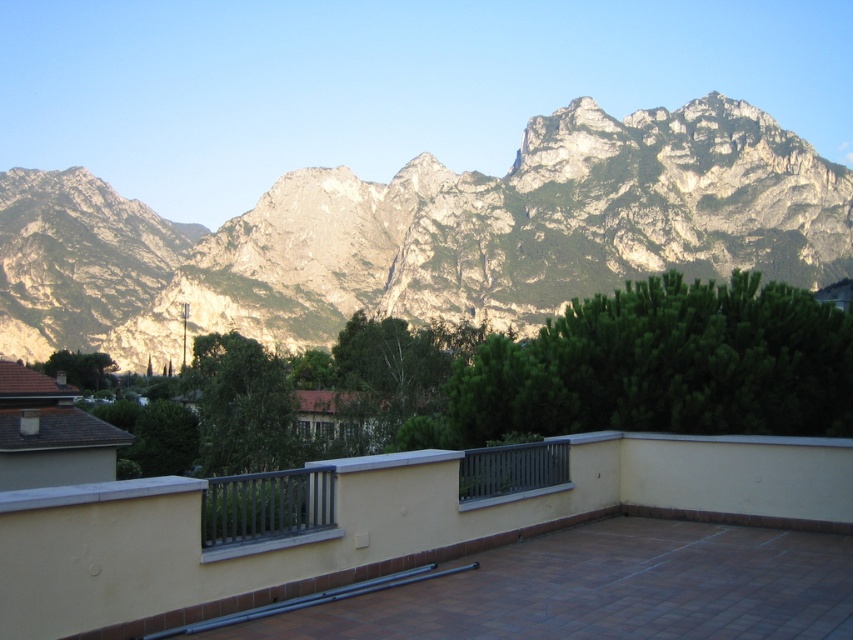
Is point (827, 208) positioned after point (219, 620)?

Yes, point (827, 208) is behind point (219, 620).

Where is `rocky gray mountain range at upper center`? The height and width of the screenshot is (640, 853). rocky gray mountain range at upper center is located at coordinates (425, 236).

Who is shorter, matte gray balcony at center or metallic gray rail at center?

Standing shorter between the two is metallic gray rail at center.

Is matte gray balcony at center positioned in front of metallic gray rail at center?

That is True.

Does point (613, 502) lie in front of point (229, 616)?

No, (613, 502) is behind (229, 616).

Image resolution: width=853 pixels, height=640 pixels. I want to click on matte gray balcony at center, so click(x=375, y=524).

Between rocky gray mountain range at upper center and matte gray balcony at center, which one is positioned lower?

matte gray balcony at center is below.

Based on the photo, between rocky gray mountain range at upper center and matte gray balcony at center, which one has more height?

With more height is rocky gray mountain range at upper center.

Where is `rocky gray mountain range at upper center`? Image resolution: width=853 pixels, height=640 pixels. rocky gray mountain range at upper center is located at coordinates (425, 236).